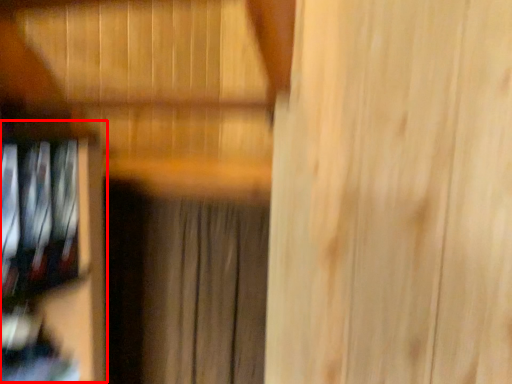
Question: From the image's perspective, what is the correct spatial positioning of shelf (annotated by the red box) in reference to curtain?

Choices:
 (A) above
 (B) below

Answer: (A)